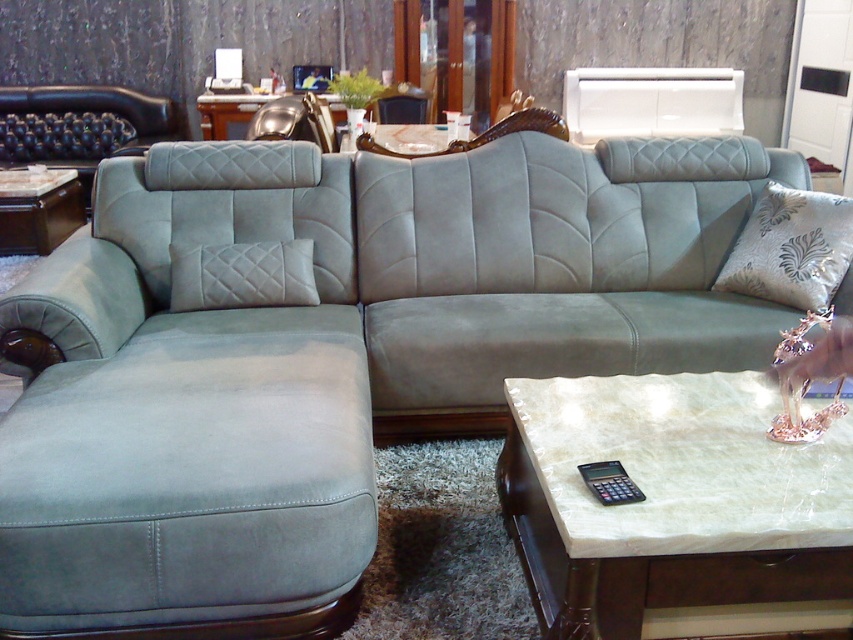
You are standing at the entrance of the living room and want to move towards the metallic gold armchair at upper center. According to the coordinates given, in which direction should you move relative to your current position?

The metallic gold armchair at upper center is located at coordinates (294, 122). Since you are at the entrance, which is typically positioned at the lower left corner of the room, you should move towards the upper right direction to reach the metallic gold armchair at upper center.

You are standing in the living room and want to determine which of the two points, point (48, 237) or point (300, 112), is closer to you. Based on the coordinates provided, which point is nearer?

Point (48, 237) is further to the camera than point (300, 112), so point (300, 112) is closer to you.